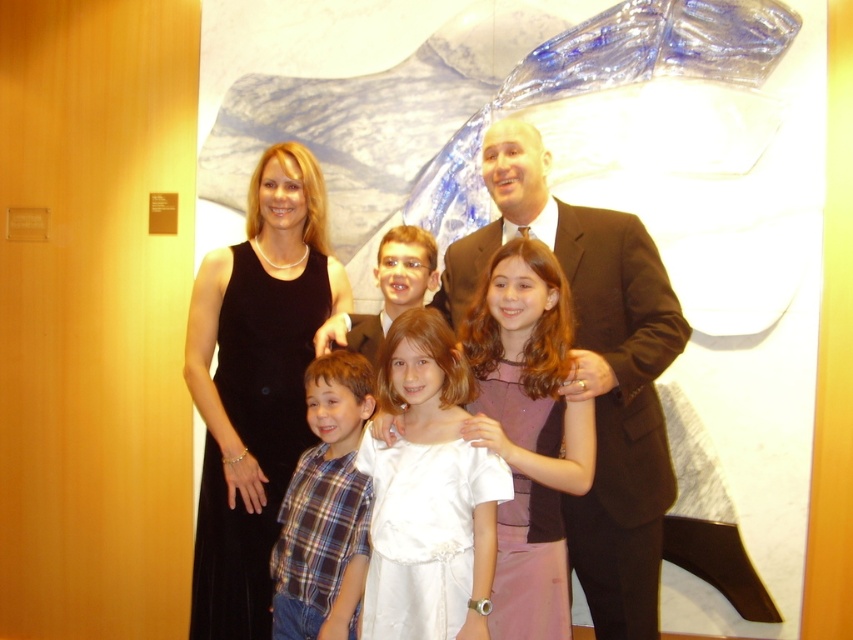
Can you confirm if black dress at center is positioned above white satin dress at center?

Yes, black dress at center is above white satin dress at center.

You are a GUI agent. You are given a task and a screenshot of the screen. Output one action in this format:
    pyautogui.click(x=<x>, y=<y>)
    Task: Click on the black dress at center
    The height and width of the screenshot is (640, 853).
    Given the screenshot: What is the action you would take?
    pyautogui.click(x=254, y=384)

Is point (218, 412) farther from camera compared to point (450, 598)?

Yes, it is.

Locate an element on the screen. black dress at center is located at coordinates (254, 384).

How far apart are dark brown suit at center and plaid shirt at center?

The distance of dark brown suit at center from plaid shirt at center is 22.90 inches.

Who is positioned more to the left, dark brown suit at center or plaid shirt at center?

plaid shirt at center is more to the left.

Which is in front, point (637, 225) or point (322, 512)?

Point (637, 225)

Image resolution: width=853 pixels, height=640 pixels. Identify the location of dark brown suit at center. (593, 369).

Between black dress at center and plaid shirt at center, which one has more height?

Standing taller between the two is black dress at center.

Which is behind, point (325, 282) or point (337, 620)?

Positioned behind is point (325, 282).

Between point (228, 557) and point (328, 420), which one is positioned in front?

Point (328, 420) is in front.

I want to click on black dress at center, so click(x=254, y=384).